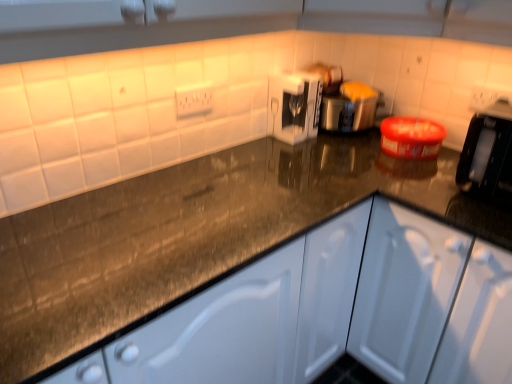
Question: Is white plastic electric outlet at upper center taller than satin silver toaster at center, marked as the first appliance in a right-to-left arrangement?

Choices:
 (A) yes
 (B) no

Answer: (B)

Question: Considering the relative sizes of white plastic electric outlet at upper center and satin silver toaster at center, the second appliance in the left-to-right sequence, in the image provided, is white plastic electric outlet at upper center thinner than satin silver toaster at center, the second appliance in the left-to-right sequence,?

Choices:
 (A) no
 (B) yes

Answer: (B)

Question: From a real-world perspective, is white plastic electric outlet at upper center physically below satin silver toaster at center, marked as the first appliance in a right-to-left arrangement?

Choices:
 (A) no
 (B) yes

Answer: (A)

Question: Considering the relative sizes of white plastic electric outlet at upper center and satin silver toaster at center, the second appliance in the left-to-right sequence, in the image provided, is white plastic electric outlet at upper center shorter than satin silver toaster at center, the second appliance in the left-to-right sequence,?

Choices:
 (A) no
 (B) yes

Answer: (B)

Question: Are white plastic electric outlet at upper center and satin silver toaster at center, the second appliance in the left-to-right sequence, far apart?

Choices:
 (A) no
 (B) yes

Answer: (A)

Question: From the image's perspective, is white glossy coffee machine at center, which appears as the first appliance when viewed from the left, above or below white plastic electric outlet at upper center?

Choices:
 (A) above
 (B) below

Answer: (A)

Question: Is white glossy coffee machine at center, which appears as the first appliance when viewed from the left, wider or thinner than white plastic electric outlet at upper center?

Choices:
 (A) wide
 (B) thin

Answer: (A)

Question: In terms of size, does white glossy coffee machine at center, which appears as the first appliance when viewed from the left, appear bigger or smaller than white plastic electric outlet at upper center?

Choices:
 (A) big
 (B) small

Answer: (A)

Question: Relative to white plastic electric outlet at upper center, is white glossy coffee machine at center, which appears as the first appliance when viewed from the left, in front or behind?

Choices:
 (A) behind
 (B) front

Answer: (A)

Question: Is point (379, 94) closer or farther from the camera than point (412, 367)?

Choices:
 (A) closer
 (B) farther

Answer: (B)

Question: In terms of width, does satin silver toaster at center, marked as the first appliance in a right-to-left arrangement, look wider or thinner when compared to white matte cabinet at center?

Choices:
 (A) thin
 (B) wide

Answer: (A)

Question: From the image's perspective, is satin silver toaster at center, marked as the first appliance in a right-to-left arrangement, positioned above or below white matte cabinet at center?

Choices:
 (A) above
 (B) below

Answer: (A)

Question: Considering the positions of satin silver toaster at center, marked as the first appliance in a right-to-left arrangement, and white matte cabinet at center in the image, is satin silver toaster at center, marked as the first appliance in a right-to-left arrangement, taller or shorter than white matte cabinet at center?

Choices:
 (A) short
 (B) tall

Answer: (A)

Question: Based on their positions, is satin silver toaster at center, the second appliance in the left-to-right sequence, located to the left or right of white glossy coffee machine at center, placed as the second appliance when sorted from right to left?

Choices:
 (A) left
 (B) right

Answer: (B)

Question: Would you say satin silver toaster at center, the second appliance in the left-to-right sequence, is inside or outside white glossy coffee machine at center, which appears as the first appliance when viewed from the left?

Choices:
 (A) inside
 (B) outside

Answer: (B)